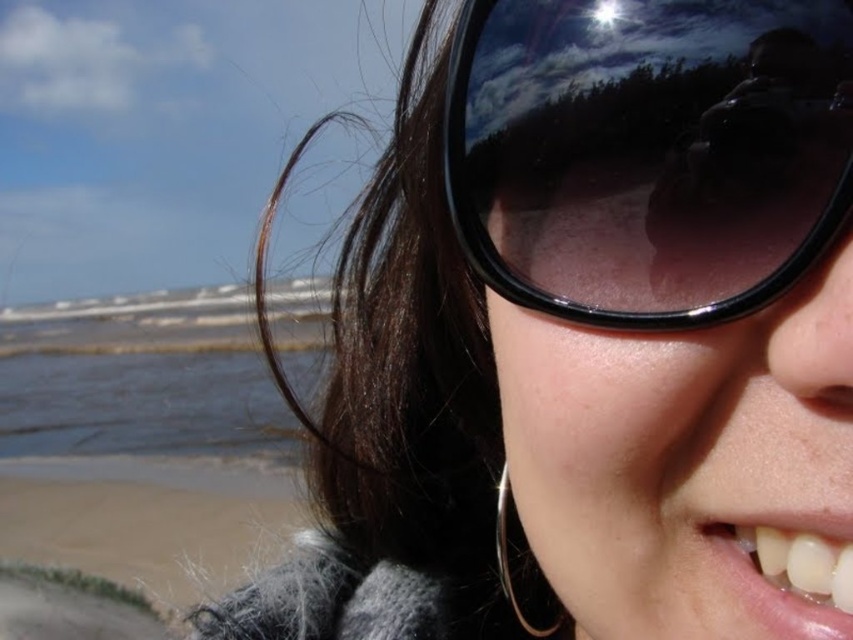
Consider the image. You are a photographer trying to adjust your camera to focus on the point at coordinates point (648, 150). Based on the scene, where exactly is this point located?

The point (648, 150) is located on the black plastic sunglasses at upper center.

You are a photographer trying to adjust the focus of your camera to capture the reflection of the trees in the black plastic sunglasses at upper center. Based on their position, is the sunglasses closer to the top or bottom edge of the image?

The black plastic sunglasses at upper center is located at point (648, 150), which means it is closer to the bottom edge of the image since the y coordinate is 0.761, indicating it is positioned lower in the frame.

Looking at this image, you are a photographer trying to capture the reflection of the beach in the sunglasses. Given that the black plastic sunglasses at upper center and the sandy beach at lower left are both in the frame, which object is closer to the camera?

The black plastic sunglasses at upper center is closer to the camera because it is shorter than the sandy beach at lower left, indicating it is positioned in front.